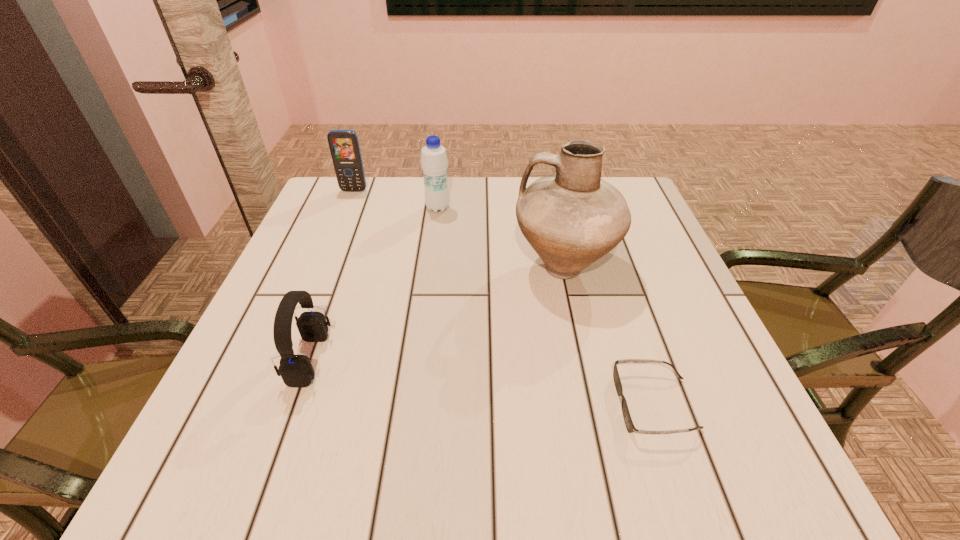
You are a GUI agent. You are given a task and a screenshot of the screen. Output one action in this format:
    pyautogui.click(x=<x>, y=<y>)
    Task: Click on the headset that is at the left edge
    
    Given the screenshot: What is the action you would take?
    pyautogui.click(x=296, y=370)

The image size is (960, 540). I want to click on pitcher at the right edge, so click(x=571, y=218).

The height and width of the screenshot is (540, 960). Find the location of `sunglasses located at the right edge`. sunglasses located at the right edge is located at coordinates (629, 424).

The height and width of the screenshot is (540, 960). What are the coordinates of `object at the far left corner` in the screenshot? It's located at (344, 146).

You are a GUI agent. You are given a task and a screenshot of the screen. Output one action in this format:
    pyautogui.click(x=<x>, y=<y>)
    Task: Click on the object at the near right corner
    This screenshot has width=960, height=540.
    Given the screenshot: What is the action you would take?
    pyautogui.click(x=629, y=424)

The height and width of the screenshot is (540, 960). I want to click on vacant space at the far edge, so click(386, 179).

In the image, there is a desktop. At what (x,y) coordinates should I click in order to perform the action: click on vacant area at the left edge. Please return your answer as a coordinate pair (x, y). The height and width of the screenshot is (540, 960). Looking at the image, I should click on (339, 266).

The width and height of the screenshot is (960, 540). Find the location of `vacant space at the right edge of the desktop`. vacant space at the right edge of the desktop is located at coordinates (637, 290).

I want to click on free space at the far left corner of the desktop, so click(x=354, y=208).

In the image, there is a desktop. Identify the location of vacant space at the near right corner. (694, 485).